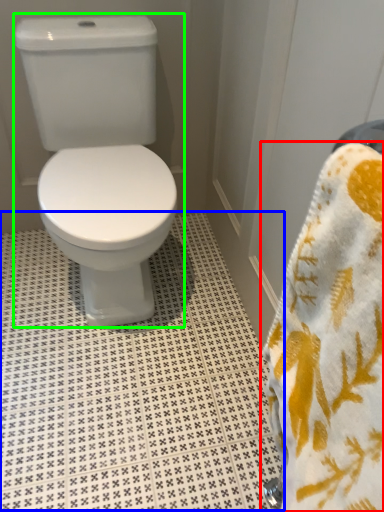
Question: Which is nearer to the towel (highlighted by a red box)? tile (highlighted by a blue box) or toilet (highlighted by a green box).

Choices:
 (A) tile
 (B) toilet

Answer: (A)